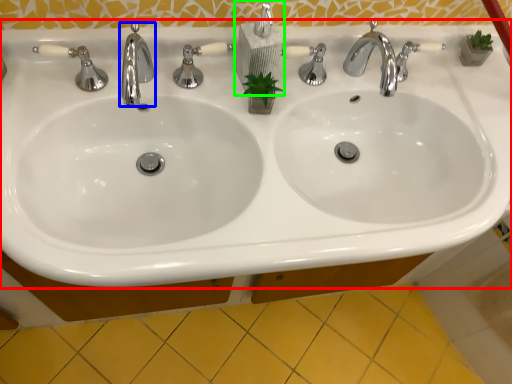
Question: Estimate the real-world distances between objects in this image. Which object is closer to sink (highlighted by a red box), tap (highlighted by a blue box) or soap dispenser (highlighted by a green box)?

Choices:
 (A) tap
 (B) soap dispenser

Answer: (B)